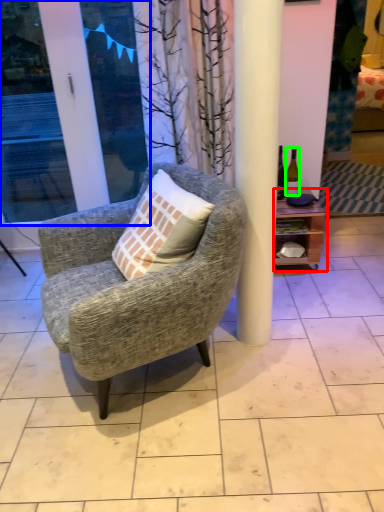
Question: Considering the real-world distances, which object is farthest from shelf (highlighted by a red box)? screen door (highlighted by a blue box) or bottle (highlighted by a green box)?

Choices:
 (A) screen door
 (B) bottle

Answer: (A)